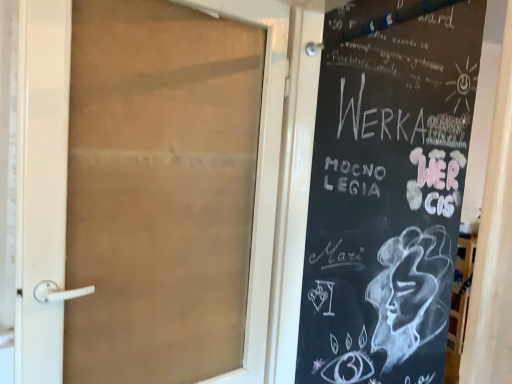
Question: Does point (352, 354) appear closer or farther from the camera than point (177, 1)?

Choices:
 (A) closer
 (B) farther

Answer: (B)

Question: Relative to translucent glass door at center, is black chalkboard at right in front or behind?

Choices:
 (A) front
 (B) behind

Answer: (A)

Question: Looking at their shapes, would you say black chalkboard at right is wider or thinner than translucent glass door at center?

Choices:
 (A) wide
 (B) thin

Answer: (A)

Question: Based on their positions, is translucent glass door at center located to the left or right of black chalkboard at right?

Choices:
 (A) right
 (B) left

Answer: (B)

Question: In terms of height, does translucent glass door at center look taller or shorter compared to black chalkboard at right?

Choices:
 (A) short
 (B) tall

Answer: (A)

Question: Does point (264, 84) appear closer or farther from the camera than point (400, 51)?

Choices:
 (A) farther
 (B) closer

Answer: (B)

Question: Is translucent glass door at center wider or thinner than black chalkboard at right?

Choices:
 (A) thin
 (B) wide

Answer: (A)